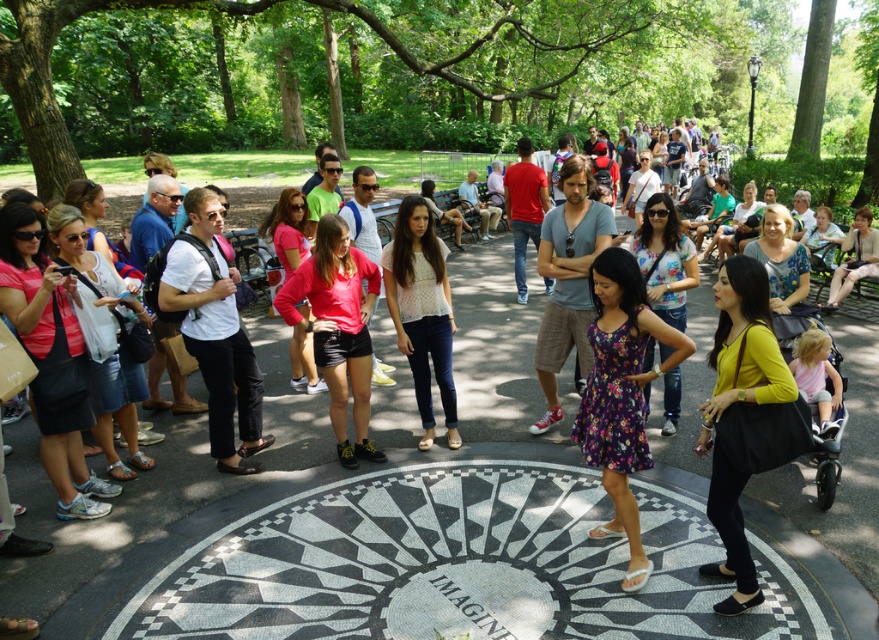
Does floral print dress at center have a lesser height compared to white matte shirt at center?

Indeed, floral print dress at center has a lesser height compared to white matte shirt at center.

Between point (607, 392) and point (208, 232), which one is positioned behind?

Positioned behind is point (208, 232).

Find the location of a particular element. floral print dress at center is located at coordinates (621, 394).

Who is positioned more to the right, black-and-white mosaic at center or floral print dress at center?

floral print dress at center is more to the right.

Is black-and-white mosaic at center taller than floral print dress at center?

No.

Is point (473, 554) more distant than point (609, 458)?

Yes, it is behind point (609, 458).

At what (x,y) coordinates should I click in order to perform the action: click on black-and-white mosaic at center. Please return your answer as a coordinate pair (x, y). The width and height of the screenshot is (879, 640). Looking at the image, I should click on (461, 564).

Measure the distance from floral print dress at center to matte yellow blouse at center.

A distance of 18.12 inches exists between floral print dress at center and matte yellow blouse at center.

The height and width of the screenshot is (640, 879). I want to click on floral print dress at center, so click(x=621, y=394).